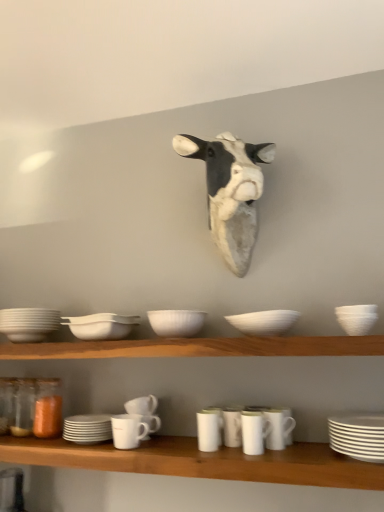
What are the coordinates of `vacant space in between white matte cup at center, positioned as the 5th tableware in right-to-left order, and white matte mug at lower center, the 5th tableware when ordered from left to right` in the screenshot? It's located at (173, 442).